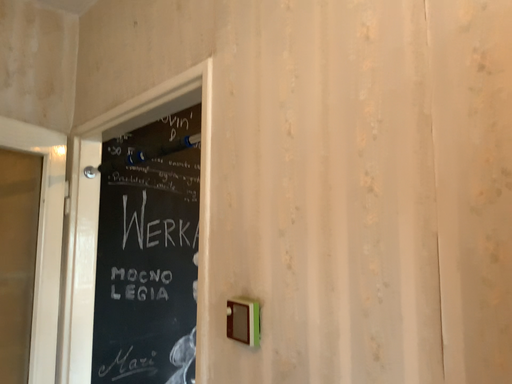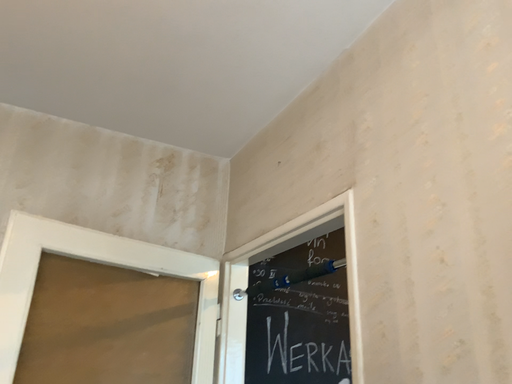
Question: Which way did the camera rotate in the video?

Choices:
 (A) rotated upward
 (B) rotated downward

Answer: (A)